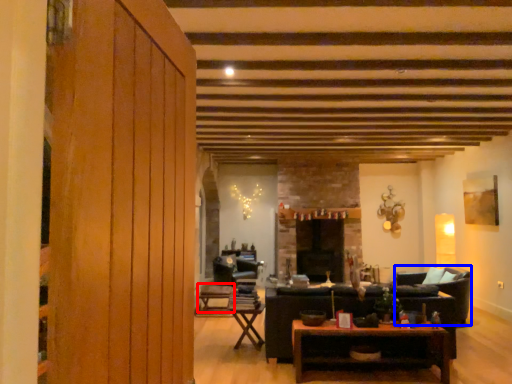
Question: Which of the following is the closest to the observer, table (highlighted by a red box) or armchair (highlighted by a blue box)?

Choices:
 (A) table
 (B) armchair

Answer: (B)